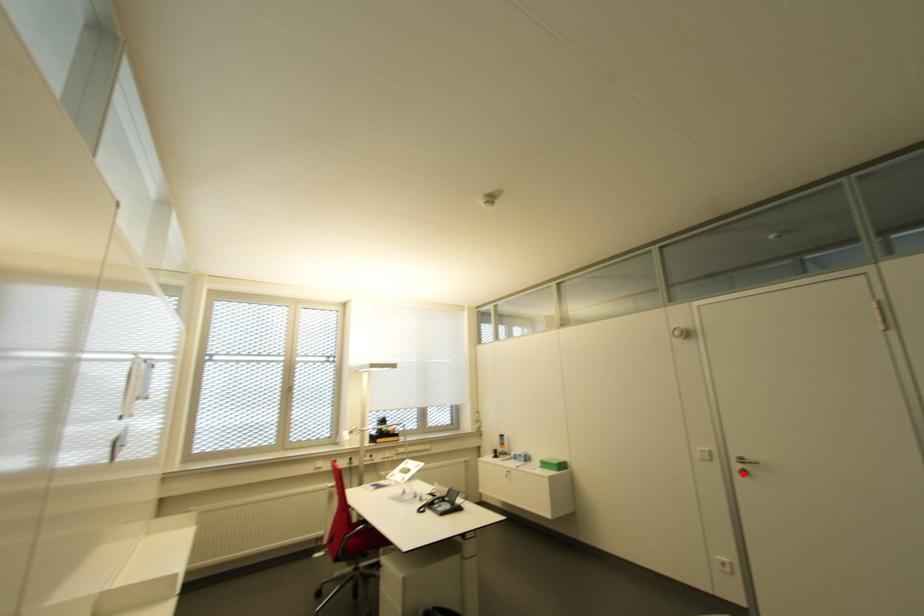
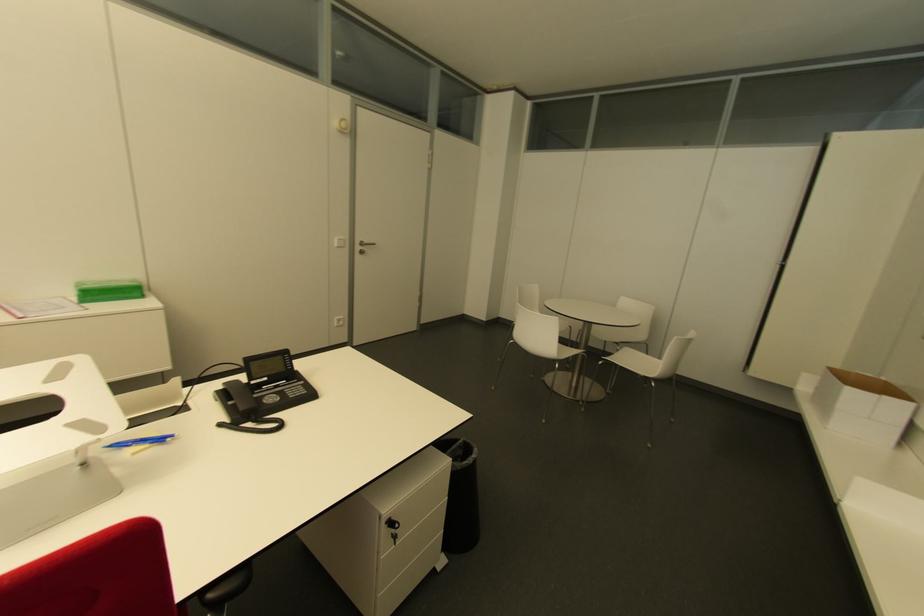
Where in the second image is the point corresponding to the highlighted location from the first image?

(360, 253)